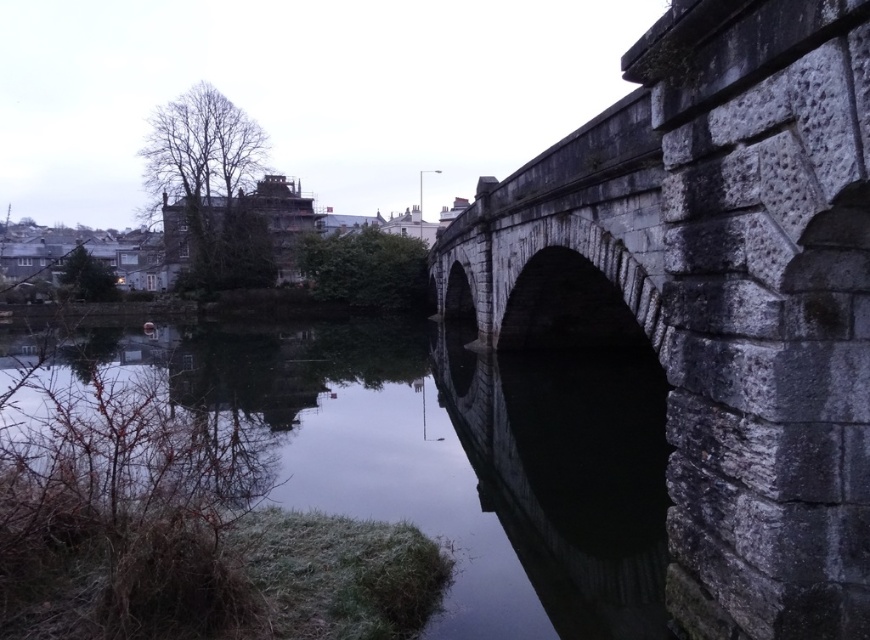
Question: Can you confirm if gray stone bridge at right is positioned above dark gray stone river at center?

Choices:
 (A) no
 (B) yes

Answer: (B)

Question: Which of the following is the farthest from the observer?

Choices:
 (A) (755, 182)
 (B) (402, 330)

Answer: (B)

Question: Among these objects, which one is nearest to the camera?

Choices:
 (A) gray stone bridge at right
 (B) dark gray stone river at center

Answer: (A)

Question: Which object appears farthest from the camera in this image?

Choices:
 (A) dark gray stone river at center
 (B) gray stone bridge at right

Answer: (A)

Question: Can you confirm if gray stone bridge at right is positioned below dark gray stone river at center?

Choices:
 (A) no
 (B) yes

Answer: (A)

Question: Can you confirm if gray stone bridge at right is positioned to the left of dark gray stone river at center?

Choices:
 (A) yes
 (B) no

Answer: (B)